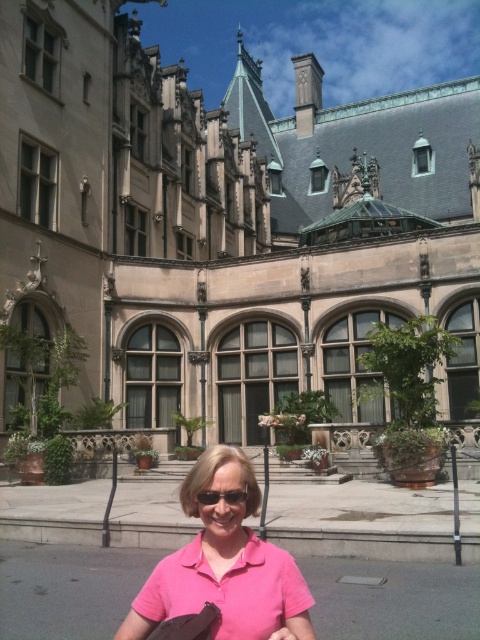
Consider the image. Can you confirm if sunglasses at center is smaller than pink fabric at lower center?

Indeed, sunglasses at center has a smaller size compared to pink fabric at lower center.

Between sunglasses at center and pink fabric at lower center, which one has less height?

pink fabric at lower center

Between point (207, 490) and point (294, 616), which one is positioned in front?

Point (294, 616)

This screenshot has height=640, width=480. I want to click on sunglasses at center, so tap(222, 497).

Can you confirm if pink fabric at center is positioned below sunglasses at center?

Yes.

Does pink fabric at center have a lesser width compared to sunglasses at center?

Incorrect, pink fabric at center's width is not less than sunglasses at center's.

Locate an element on the screen. The width and height of the screenshot is (480, 640). pink fabric at center is located at coordinates (222, 563).

Based on the photo, who is more distant from viewer, (139, 604) or (280, 632)?

Point (139, 604)

What are the coordinates of `pink fabric at center` in the screenshot? It's located at (222, 563).

Which is in front, point (259, 548) or point (297, 637)?

Point (297, 637)

Where is `pink fabric at center`? This screenshot has height=640, width=480. pink fabric at center is located at coordinates (222, 563).